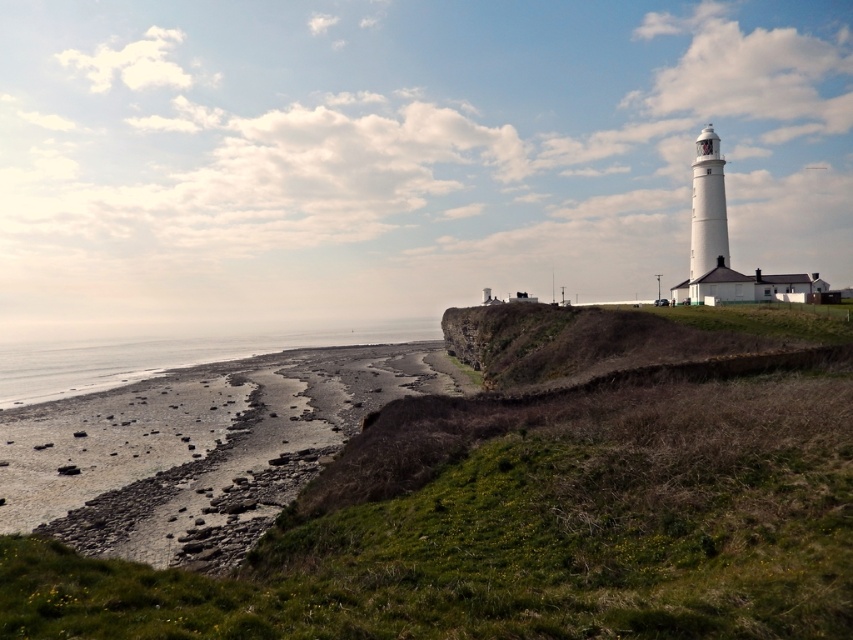
Question: Does smooth pebbles at lower left come in front of gray sand at lower left?

Choices:
 (A) yes
 (B) no

Answer: (A)

Question: Which point is closer to the camera?

Choices:
 (A) (53, 476)
 (B) (322, 340)

Answer: (A)

Question: Is smooth pebbles at lower left below gray sand at lower left?

Choices:
 (A) no
 (B) yes

Answer: (B)

Question: Which point is farther from the camera taking this photo?

Choices:
 (A) (84, 372)
 (B) (254, 440)

Answer: (A)

Question: Is smooth pebbles at lower left above gray sand at lower left?

Choices:
 (A) yes
 (B) no

Answer: (B)